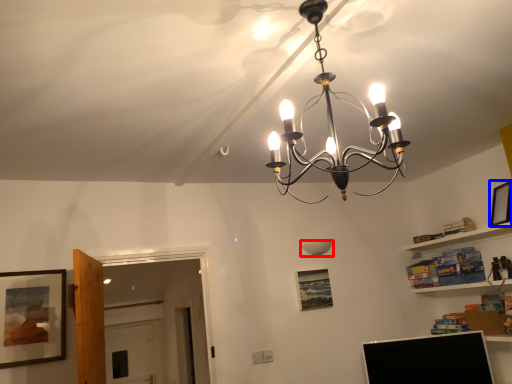
Question: Which point is closer to the camera, lamp (highlighted by a red box) or picture frame (highlighted by a blue box)?

Choices:
 (A) lamp
 (B) picture frame

Answer: (B)